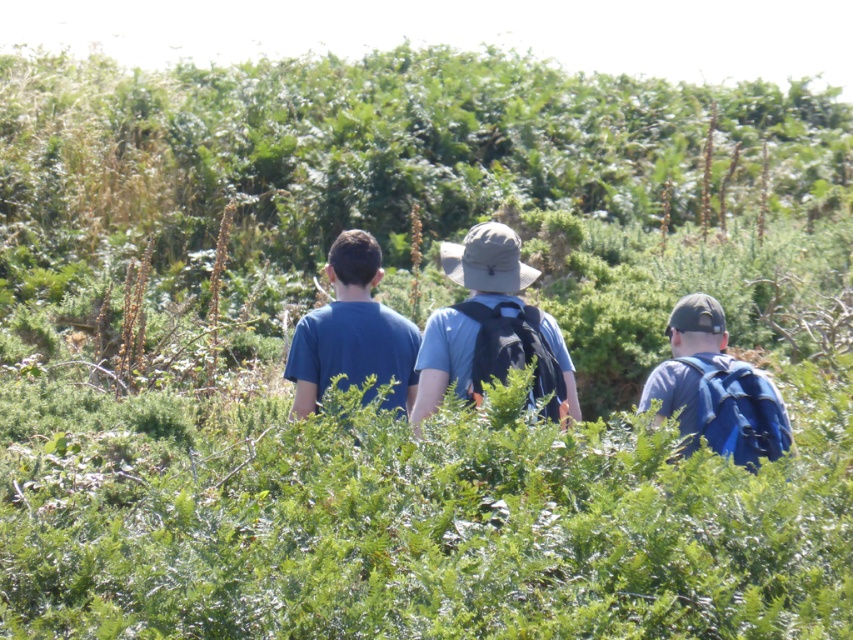
You are part of a group of hikers in a dense forest. You notice two people wearing blue shirts ahead of you. One is labeled as the matte blue shirt at center and the other as the blue matte shirt at center. From your perspective, which shirt is positioned to the right?

The matte blue shirt at center is positioned to the right of the blue matte shirt at center, so the matte blue shirt at center is on the right side.